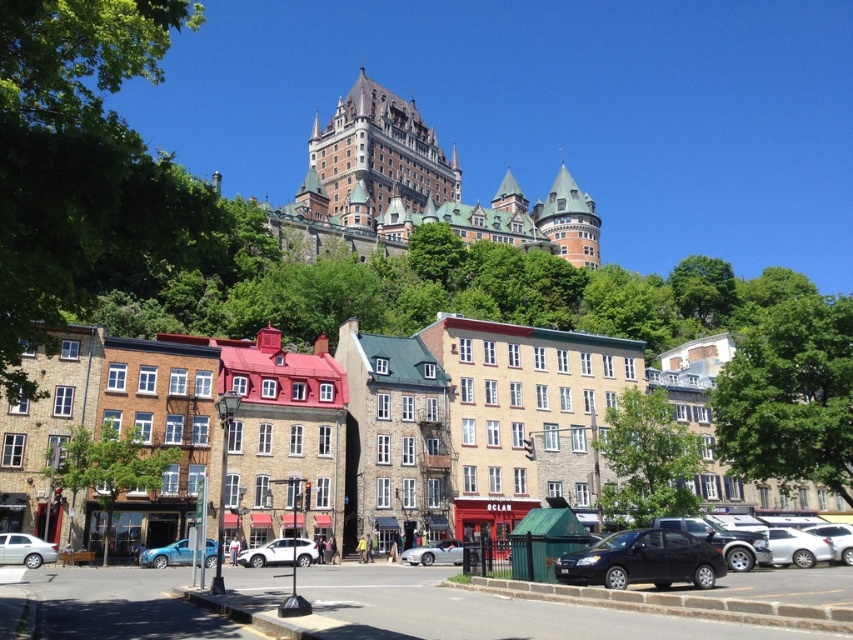
Is stone buildings at center to the left of metallic blue sedan at lower left from the viewer's perspective?

In fact, stone buildings at center is to the right of metallic blue sedan at lower left.

Who is shorter, stone buildings at center or metallic blue sedan at lower left?

Standing shorter between the two is metallic blue sedan at lower left.

Who is more distant from viewer, (120, 433) or (187, 561)?

Point (120, 433)

Find the location of a particular element. This screenshot has height=640, width=853. stone buildings at center is located at coordinates (323, 424).

Is brown stone castle at upper center smaller than green leafy tree at upper center?

No.

Does point (367, 92) come behind point (712, 307)?

Yes, point (367, 92) is behind point (712, 307).

Find the location of a particular element. This screenshot has height=640, width=853. brown stone castle at upper center is located at coordinates (376, 157).

Does green leafy tree at upper center appear on the right side of silver metallic convertible at center?

Yes, green leafy tree at upper center is to the right of silver metallic convertible at center.

Does green leafy tree at upper center have a lesser height compared to silver metallic convertible at center?

In fact, green leafy tree at upper center may be taller than silver metallic convertible at center.

Who is more forward, (x=705, y=278) or (x=405, y=556)?

Point (x=405, y=556) is in front.

Find the location of a particular element. Image resolution: width=853 pixels, height=640 pixels. green leafy tree at upper center is located at coordinates (703, 289).